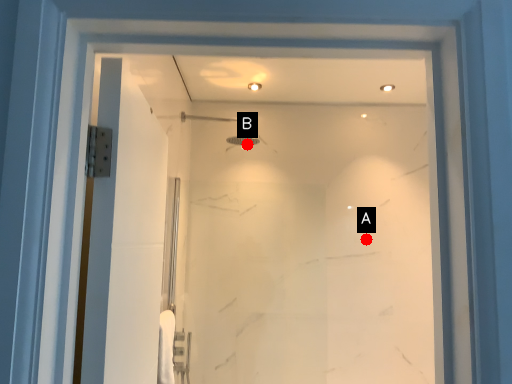
Question: Two points are circled on the image, labeled by A and B beside each circle. Which of the following is the closest to the observer?

Choices:
 (A) A is closer
 (B) B is closer

Answer: (A)